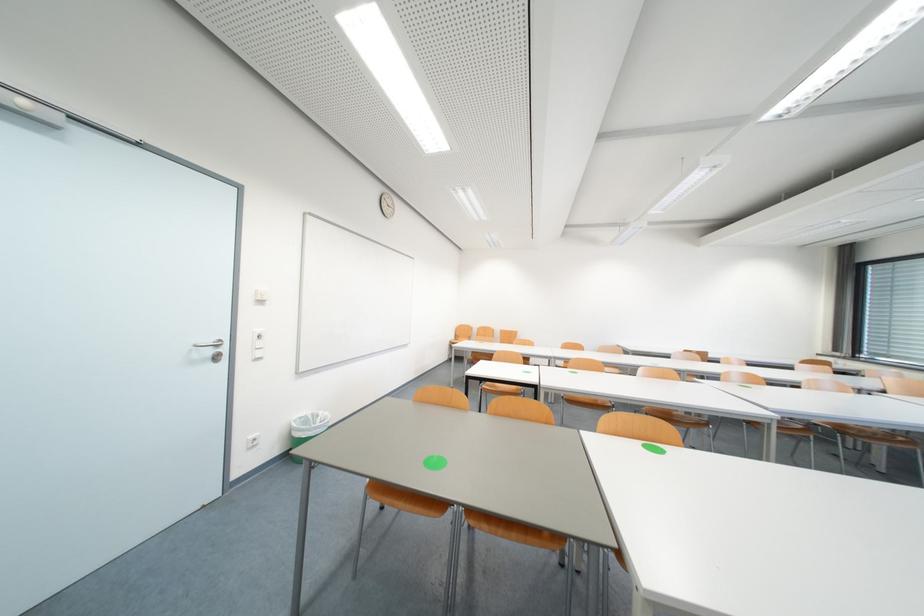
Where would you push the white light switch? Please return your answer as a coordinate pair (x, y).

(257, 344)